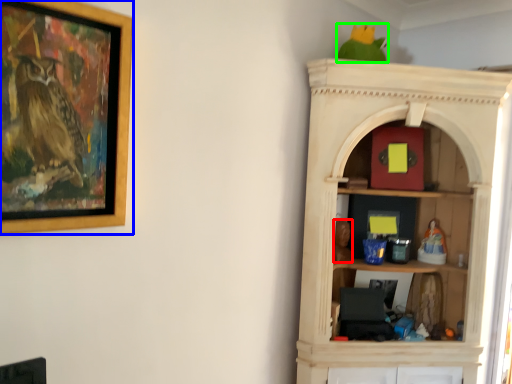
Question: Based on their relative distances, which object is farther from toy (highlighted by a red box)? Choose from picture frame (highlighted by a blue box) and parrot (highlighted by a green box).

Choices:
 (A) picture frame
 (B) parrot

Answer: (A)